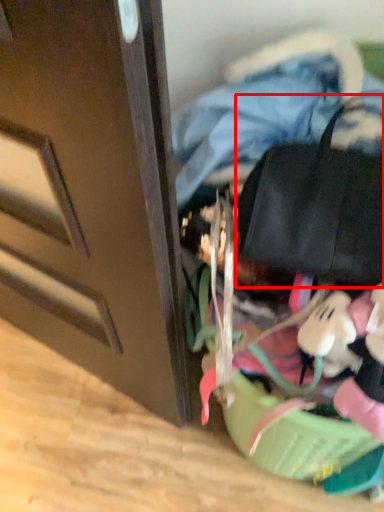
Question: From the image's perspective, considering the relative positions of messenger bag (annotated by the red box) and clothing in the image provided, where is messenger bag (annotated by the red box) located with respect to the staircase?

Choices:
 (A) above
 (B) below

Answer: (B)